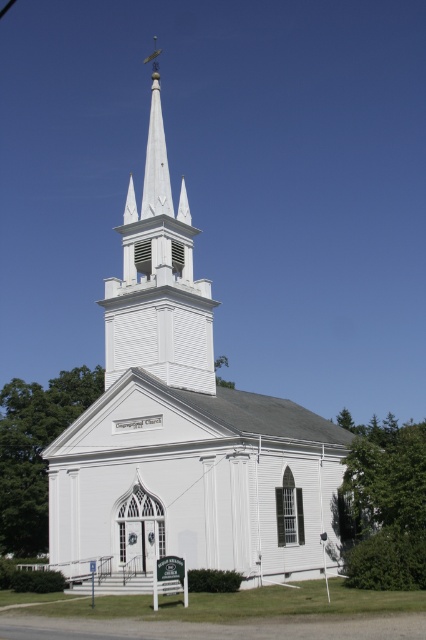
You are standing in front of the church and want to take a photo that includes both the white wooden church at center and the white wooden steeple at center. Which one should you adjust your camera angle to include first if you want to capture both in the frame?

The white wooden church at center is taller than the white wooden steeple at center, so you should adjust your camera angle to include the white wooden church at center first to ensure both are in the frame.

You are standing in front of the church and want to take a photo of the white wooden steeple at center. However, the white wooden church at center is blocking your view. Can you move to a position where you can see the steeple without the church blocking it?

The white wooden church at center is in front of the white wooden steeple at center, so you cannot see the steeple without the church blocking it. You would need to move around to the side or behind the church to get an unobstructed view of the steeple.

You are standing in front of the white wooden church at center and the white wooden steeple at center. Which one is positioned higher from the ground?

The white wooden church at center is above the white wooden steeple at center, so the white wooden church at center is positioned higher from the ground.